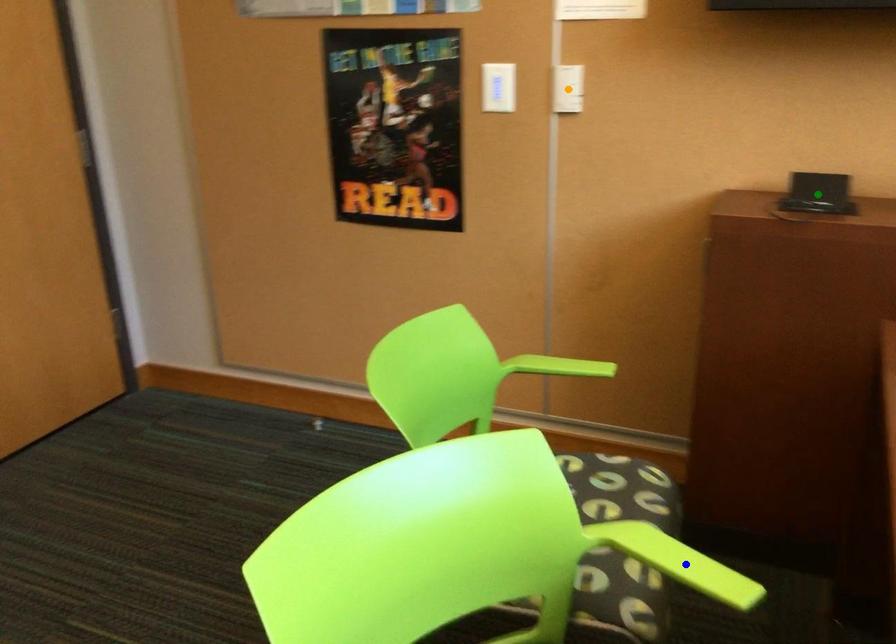
Order these from nearest to farthest:
green point
blue point
orange point

blue point < green point < orange point